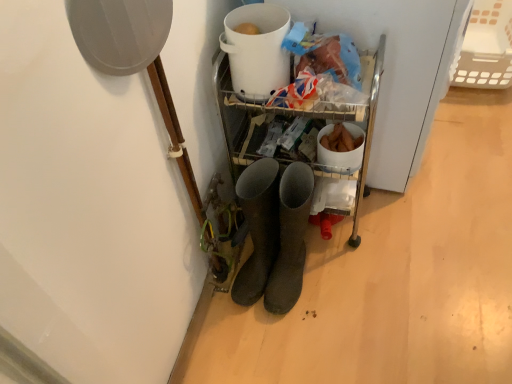
The width and height of the screenshot is (512, 384). What do you see at coordinates (487, 47) in the screenshot?
I see `white plastic basket at upper right` at bounding box center [487, 47].

Where is `white plastic basket at upper right`? This screenshot has height=384, width=512. white plastic basket at upper right is located at coordinates (487, 47).

Based on the photo, is dark gray rubber boots at center in contact with white plastic basket at upper right?

No, dark gray rubber boots at center is not touching white plastic basket at upper right.

This screenshot has width=512, height=384. There is a white plastic basket at upper right. In order to click on footwear above it (from a real-world perspective) in this screenshot , I will do `click(290, 238)`.

From the image's perspective, is dark gray rubber boots at center above white plastic basket at upper right?

No, from the image's perspective, dark gray rubber boots at center is not on top of white plastic basket at upper right.

Does white plastic basket at upper right have a lesser width compared to white plastic bucket at upper center?

No.

Which is more to the left, white plastic basket at upper right or white plastic bucket at upper center?

white plastic bucket at upper center.

Is white plastic basket at upper right behind white plastic bucket at upper center?

That is True.

Are white plastic basket at upper right and white plastic bucket at upper center far apart?

Yes, white plastic basket at upper right and white plastic bucket at upper center are located far from each other.

Is dark gray rubber boots at center wider than white plastic bucket at upper center?

Yes, dark gray rubber boots at center is wider than white plastic bucket at upper center.

Is point (296, 279) closer or farther from the camera than point (239, 59)?

Point (296, 279).

From the image's perspective, who appears lower, dark gray rubber boots at center or white plastic bucket at upper center?

From the image's view, dark gray rubber boots at center is below.

How many degrees apart are the facing directions of white plastic bucket at upper center and white plastic basket at upper right?

0.000213 degrees.

Consider the image. Who is smaller, white plastic bucket at upper center or white plastic basket at upper right?

white plastic bucket at upper center.

Which object is positioned more to the left, white plastic bucket at upper center or white plastic basket at upper right?

From the viewer's perspective, white plastic bucket at upper center appears more on the left side.

Is white plastic bucket at upper center thinner than white plastic basket at upper right?

Correct, the width of white plastic bucket at upper center is less than that of white plastic basket at upper right.

The image size is (512, 384). What are the coordinates of `footwear located in front of the white plastic basket at upper right` in the screenshot? It's located at point(290,238).

Does white plastic basket at upper right have a greater height compared to dark gray rubber boots at center?

No.

Can you tell me how much white plastic basket at upper right and dark gray rubber boots at center differ in facing direction?

90 degrees separate the facing orientations of white plastic basket at upper right and dark gray rubber boots at center.

Is white plastic bucket at upper center thinner than dark gray rubber boots at center?

Indeed, white plastic bucket at upper center has a lesser width compared to dark gray rubber boots at center.

Considering the sizes of objects white plastic bucket at upper center and dark gray rubber boots at center in the image provided, who is bigger, white plastic bucket at upper center or dark gray rubber boots at center?

dark gray rubber boots at center.

Consider the image. From a real-world perspective, is white plastic bucket at upper center beneath dark gray rubber boots at center?

No, from a real-world perspective, white plastic bucket at upper center is not beneath dark gray rubber boots at center.

Between white plastic bucket at upper center and dark gray rubber boots at center, which one is positioned in front?

dark gray rubber boots at center.

Find the location of a particular element. basket above the dark gray rubber boots at center (from the image's perspective) is located at coordinates (487, 47).

You are a GUI agent. You are given a task and a screenshot of the screen. Output one action in this format:
    pyautogui.click(x=<x>, y=<y>)
    Task: Click on the basket below the white plastic bucket at upper center (from a real-world perspective)
    The image size is (512, 384).
    Given the screenshot: What is the action you would take?
    pyautogui.click(x=487, y=47)

Looking at the image, which one is located further to white plastic bucket at upper center, dark gray rubber boots at center or white plastic basket at upper right?

white plastic basket at upper right is further to white plastic bucket at upper center.

Based on their spatial positions, is dark gray rubber boots at center or white plastic bucket at upper center further from white plastic basket at upper right?

Among the two, dark gray rubber boots at center is located further to white plastic basket at upper right.

From the picture: When comparing their distances from white plastic bucket at upper center, does white plastic basket at upper right or dark gray rubber boots at center seem closer?

dark gray rubber boots at center.

Which object lies nearer to the anchor point dark gray rubber boots at center, white plastic bucket at upper center or white plastic basket at upper right?

white plastic bucket at upper center is closer to dark gray rubber boots at center.

Looking at this image, based on their spatial positions, is white plastic bucket at upper center or dark gray rubber boots at center closer to white plastic basket at upper right?

Based on the image, white plastic bucket at upper center appears to be nearer to white plastic basket at upper right.

When comparing their distances from dark gray rubber boots at center, does white plastic basket at upper right or white plastic bucket at upper center seem further?

white plastic basket at upper right lies further to dark gray rubber boots at center than the other object.

I want to click on footwear between white plastic bucket at upper center and white plastic basket at upper right from left to right, so click(x=290, y=238).